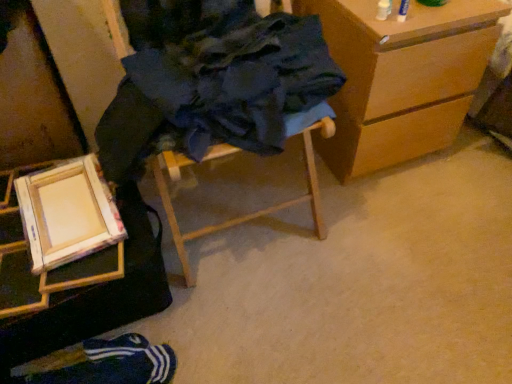
Locate an element on the screen. This screenshot has width=512, height=384. wooden frame at lower left is located at coordinates (67, 213).

The width and height of the screenshot is (512, 384). What do you see at coordinates (101, 319) in the screenshot?
I see `wooden easel at lower left, the first furniture viewed from the left` at bounding box center [101, 319].

Measure the distance between wooden folding chair at center, the first furniture from the right, and camera.

35.07 inches.

Image resolution: width=512 pixels, height=384 pixels. What do you see at coordinates (244, 215) in the screenshot? I see `wooden folding chair at center, positioned as the second furniture in left-to-right order` at bounding box center [244, 215].

Find the location of `wooden chest of drawers at right`. wooden chest of drawers at right is located at coordinates (401, 78).

Based on the photo, how many degrees apart are the facing directions of wooden folding chair at center, the first furniture from the right, and wooden chest of drawers at right?

The angle between the facing direction of wooden folding chair at center, the first furniture from the right, and the facing direction of wooden chest of drawers at right is 2.02 degrees.

From the image's perspective, is wooden folding chair at center, positioned as the second furniture in left-to-right order, located above or below wooden chest of drawers at right?

Based on their image positions, wooden folding chair at center, positioned as the second furniture in left-to-right order, is located beneath wooden chest of drawers at right.

Is wooden folding chair at center, the first furniture from the right, at the right side of wooden chest of drawers at right?

Incorrect, wooden folding chair at center, the first furniture from the right, is not on the right side of wooden chest of drawers at right.

Is wooden folding chair at center, positioned as the second furniture in left-to-right order, wider or thinner than wooden chest of drawers at right?

Considering their sizes, wooden folding chair at center, positioned as the second furniture in left-to-right order, looks slimmer than wooden chest of drawers at right.

Does wooden frame at lower left appear on the right side of wooden folding chair at center, the first furniture from the right?

No, wooden frame at lower left is not to the right of wooden folding chair at center, the first furniture from the right.

From a real-world perspective, is wooden frame at lower left above or below wooden folding chair at center, positioned as the second furniture in left-to-right order?

wooden frame at lower left is situated lower than wooden folding chair at center, positioned as the second furniture in left-to-right order, in the real world.

Which of these two, wooden frame at lower left or wooden folding chair at center, positioned as the second furniture in left-to-right order, is thinner?

Thinner between the two is wooden frame at lower left.

Is wooden folding chair at center, the first furniture from the right, not inside wooden easel at lower left, which is the 2th furniture in right-to-left order?

Yes, wooden folding chair at center, the first furniture from the right, is located beyond the bounds of wooden easel at lower left, which is the 2th furniture in right-to-left order.

From the image's perspective, relative to wooden easel at lower left, which is the 2th furniture in right-to-left order, is wooden folding chair at center, positioned as the second furniture in left-to-right order, above or below?

From the image's perspective, wooden folding chair at center, positioned as the second furniture in left-to-right order, appears above wooden easel at lower left, which is the 2th furniture in right-to-left order.

Can you see wooden folding chair at center, positioned as the second furniture in left-to-right order, touching wooden easel at lower left, which is the 2th furniture in right-to-left order?

wooden folding chair at center, positioned as the second furniture in left-to-right order, is not next to wooden easel at lower left, which is the 2th furniture in right-to-left order, and they're not touching.

Is point (283, 1) behind point (71, 314)?

Yes, point (283, 1) is farther from viewer.

Considering the sizes of wooden folding chair at center, positioned as the second furniture in left-to-right order, and blue fabric socks at lower left in the image, is wooden folding chair at center, positioned as the second furniture in left-to-right order, wider or thinner than blue fabric socks at lower left?

Clearly, wooden folding chair at center, positioned as the second furniture in left-to-right order, has more width compared to blue fabric socks at lower left.

Is wooden folding chair at center, positioned as the second furniture in left-to-right order, positioned with its back to blue fabric socks at lower left?

wooden folding chair at center, positioned as the second furniture in left-to-right order, does not have its back to blue fabric socks at lower left.

From their relative heights in the image, would you say wooden folding chair at center, positioned as the second furniture in left-to-right order, is taller or shorter than blue fabric socks at lower left?

Considering their sizes, wooden folding chair at center, positioned as the second furniture in left-to-right order, has more height than blue fabric socks at lower left.

Which object is positioned more to the right, wooden folding chair at center, positioned as the second furniture in left-to-right order, or blue fabric socks at lower left?

wooden folding chair at center, positioned as the second furniture in left-to-right order.

Is wooden frame at lower left facing away from blue fabric socks at lower left?

wooden frame at lower left is not turned away from blue fabric socks at lower left.

How many degrees apart are the facing directions of wooden frame at lower left and blue fabric socks at lower left?

There is a 81.5-degree angle between the facing directions of wooden frame at lower left and blue fabric socks at lower left.

Considering the sizes of objects wooden frame at lower left and blue fabric socks at lower left in the image provided, who is thinner, wooden frame at lower left or blue fabric socks at lower left?

wooden frame at lower left.

From a real-world perspective, relative to blue fabric socks at lower left, is wooden frame at lower left vertically above or below?

From a real-world perspective, wooden frame at lower left is physically above blue fabric socks at lower left.

Considering their positions, is blue fabric socks at lower left located in front of or behind wooden folding chair at center, the first furniture from the right?

Clearly, blue fabric socks at lower left is behind wooden folding chair at center, the first furniture from the right.

Is blue fabric socks at lower left inside or outside of wooden folding chair at center, the first furniture from the right?

blue fabric socks at lower left is not inside wooden folding chair at center, the first furniture from the right, it's outside.

Is wooden folding chair at center, positioned as the second furniture in left-to-right order, at the back of blue fabric socks at lower left?

No.

Between wooden easel at lower left, the first furniture viewed from the left, and wooden chest of drawers at right, which one has more height?

wooden chest of drawers at right is taller.

Is wooden easel at lower left, which is the 2th furniture in right-to-left order, facing towards wooden chest of drawers at right?

No, wooden easel at lower left, which is the 2th furniture in right-to-left order, is not aimed at wooden chest of drawers at right.

Is point (82, 377) farther from camera compared to point (415, 35)?

No.

In the image, there is a wooden folding chair at center, the first furniture from the right. Where is `the chest of drawers above it (from the image's perspective)`? This screenshot has width=512, height=384. the chest of drawers above it (from the image's perspective) is located at coordinates (401, 78).

This screenshot has width=512, height=384. What are the coordinates of `picture frame that is on the left side of wooden folding chair at center, positioned as the second furniture in left-to-right order` in the screenshot? It's located at (67, 213).

Based on their spatial positions, is wooden easel at lower left, which is the 2th furniture in right-to-left order, or wooden chest of drawers at right closer to blue fabric socks at lower left?

The object closer to blue fabric socks at lower left is wooden easel at lower left, which is the 2th furniture in right-to-left order.

Looking at the image, which one is located closer to blue fabric socks at lower left, wooden chest of drawers at right or wooden folding chair at center, positioned as the second furniture in left-to-right order?

Based on the image, wooden folding chair at center, positioned as the second furniture in left-to-right order, appears to be nearer to blue fabric socks at lower left.

Which object lies further to the anchor point wooden folding chair at center, the first furniture from the right, wooden chest of drawers at right or blue fabric socks at lower left?

blue fabric socks at lower left is further to wooden folding chair at center, the first furniture from the right.

From the image, which object appears to be nearer to wooden folding chair at center, the first furniture from the right, blue fabric socks at lower left or wooden frame at lower left?

wooden frame at lower left is positioned closer to the anchor wooden folding chair at center, the first furniture from the right.

From the image, which object appears to be nearer to wooden folding chair at center, the first furniture from the right, wooden chest of drawers at right or wooden frame at lower left?

Among the two, wooden chest of drawers at right is located nearer to wooden folding chair at center, the first furniture from the right.

Which object lies nearer to the anchor point wooden chest of drawers at right, blue fabric socks at lower left or wooden folding chair at center, the first furniture from the right?

The object closer to wooden chest of drawers at right is wooden folding chair at center, the first furniture from the right.

Considering their positions, is blue fabric socks at lower left positioned further to wooden easel at lower left, which is the 2th furniture in right-to-left order, than wooden frame at lower left?

Based on the image, wooden frame at lower left appears to be further to wooden easel at lower left, which is the 2th furniture in right-to-left order.

From the image, which object appears to be nearer to blue fabric socks at lower left, wooden folding chair at center, the first furniture from the right, or wooden easel at lower left, the first furniture viewed from the left?

Among the two, wooden easel at lower left, the first furniture viewed from the left, is located nearer to blue fabric socks at lower left.

I want to click on picture frame between wooden easel at lower left, which is the 2th furniture in right-to-left order, and wooden chest of drawers at right, in the horizontal direction, so coord(67,213).

The width and height of the screenshot is (512, 384). In order to click on furniture between wooden frame at lower left and blue fabric socks at lower left in the vertical direction in this screenshot , I will do `click(101, 319)`.

Where is `furniture between wooden folding chair at center, the first furniture from the right, and blue fabric socks at lower left in the up-down direction`? furniture between wooden folding chair at center, the first furniture from the right, and blue fabric socks at lower left in the up-down direction is located at coordinates (101, 319).

This screenshot has height=384, width=512. I want to click on person between wooden easel at lower left, which is the 2th furniture in right-to-left order, and wooden chest of drawers at right, so click(x=112, y=364).